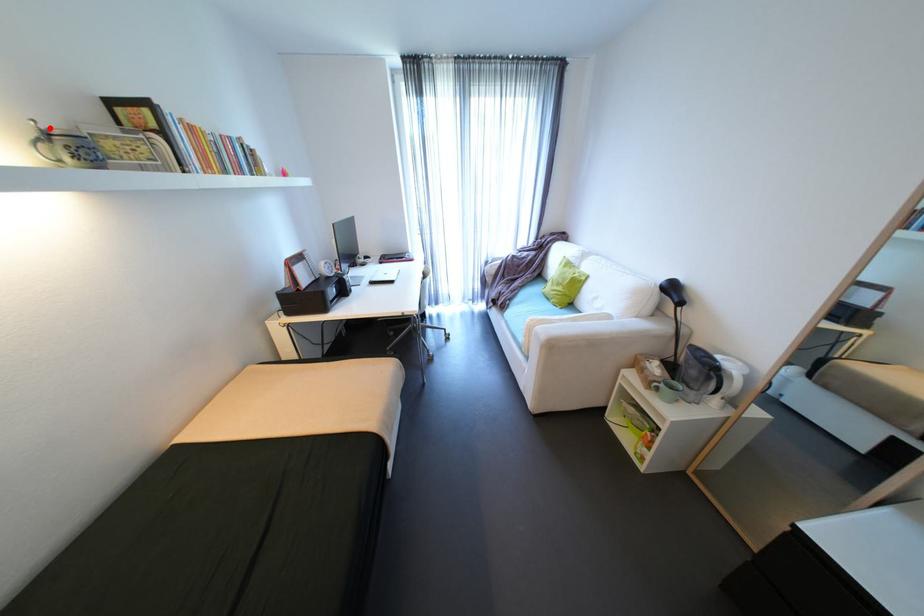
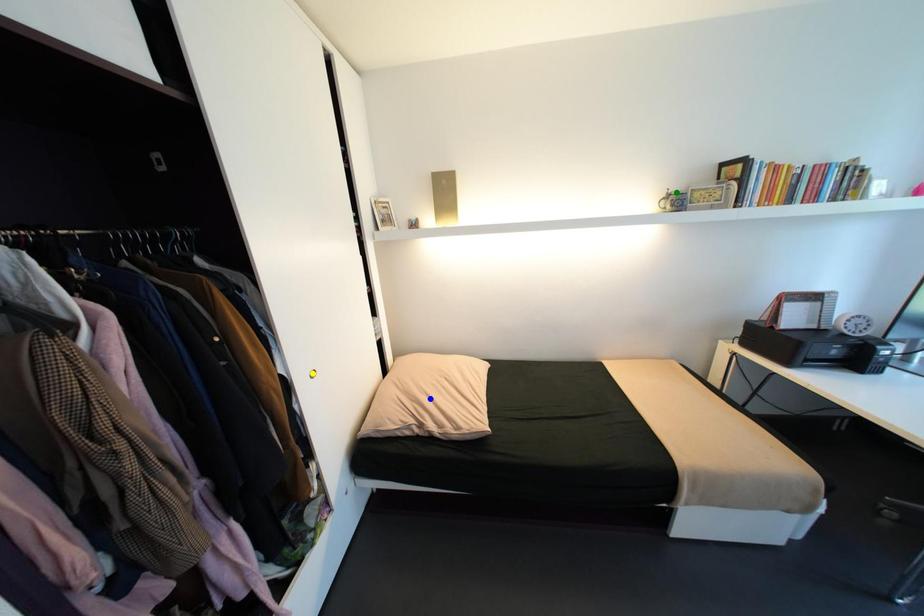
Question: I am providing you with two images of the same scene from different viewpoints. A red point is marked on the first image. You are given multiple points on the second image. In image 2, which mark is for the same physical point as the one in image 1?

Choices:
 (A) blue point
 (B) yellow point
 (C) green point

Answer: (C)